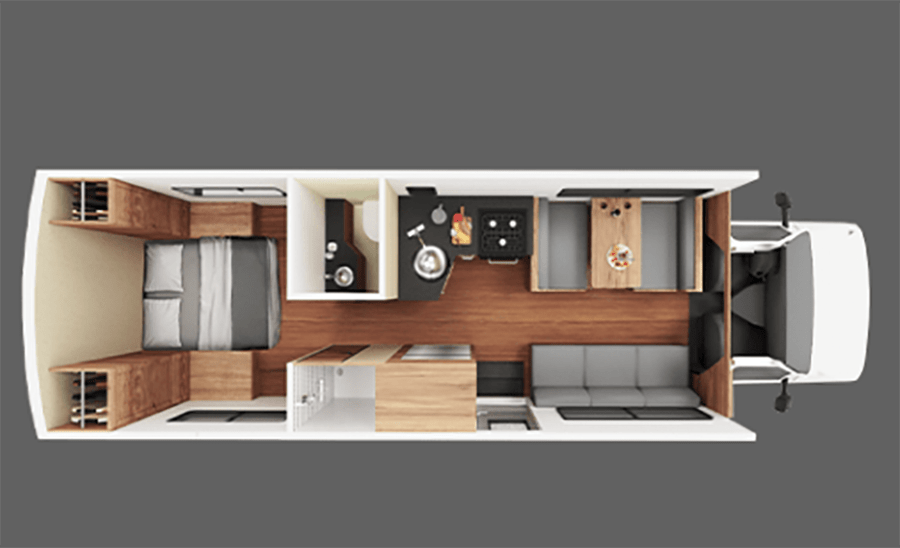
The width and height of the screenshot is (900, 548). What are the coordinates of `table` in the screenshot? It's located at (164, 322), (612, 241).